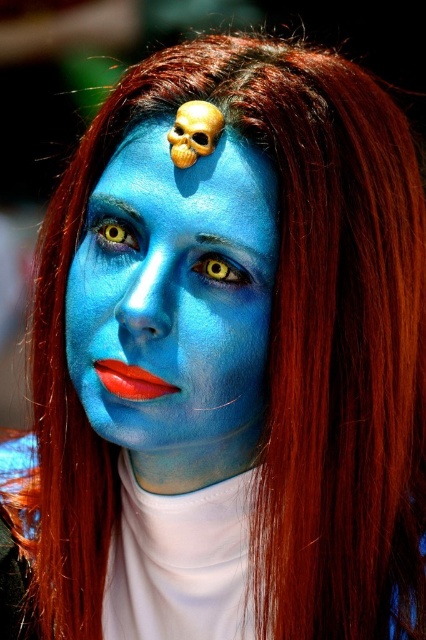
You are a photographer trying to capture the blue matte face at center and the yellow matte eye at upper left in a single frame. Based on their positions, which object should you focus on first to ensure both are in focus?

The blue matte face at center is below the yellow matte eye at upper left, so focusing on the yellow matte eye at upper left first would ensure both are in focus since it is closer to the camera.

You are a photographer setting up a shot. The subject has blue matte face paint at center. You want to focus on the face paint while keeping the golden skull ornament visible but slightly out of focus. What adjustment should you make to the camera?

To focus on the blue matte face paint at center while keeping the golden skull ornament slightly out of focus, adjust the camera to a shallow depth of field. This will keep the face paint sharp while blurring the background and other elements like the golden skull ornament.

You are a photographer trying to capture a closeup shot of the blue matte face at center and the yellow matte eye at upper left. You want to ensure both are in focus. Which object should you adjust your camera focus on first to ensure the wider one is sharp?

The blue matte face at center is wider than the yellow matte eye at upper left, so you should focus on the blue matte face at center first to ensure it is sharp.